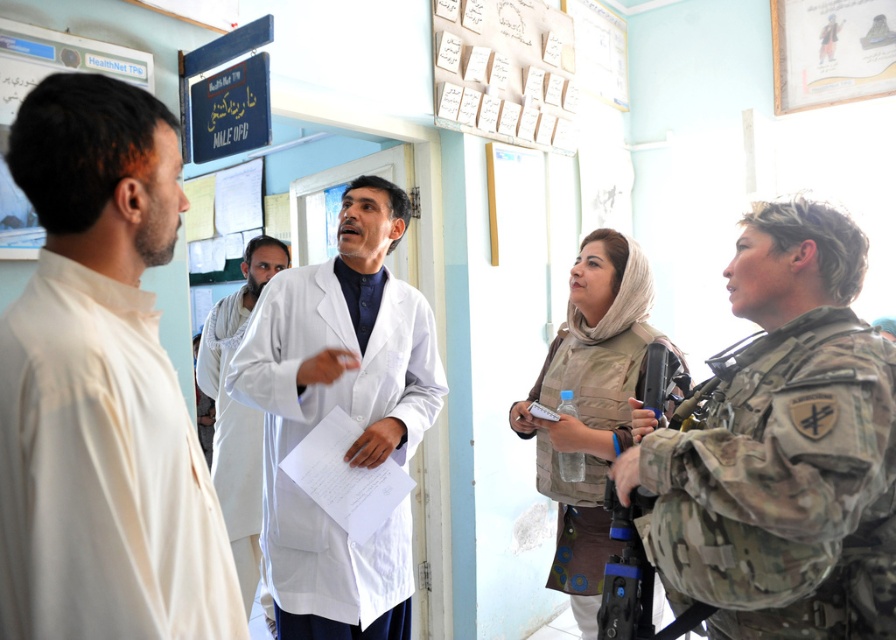
Question: Is white lab coat at left bigger than white lab coat at center?

Choices:
 (A) no
 (B) yes

Answer: (A)

Question: Is camouflage fabric uniform at right bigger than white lab coat at center?

Choices:
 (A) yes
 (B) no

Answer: (B)

Question: Does camouflage fabric uniform at right have a smaller size compared to camouflage vest at center?

Choices:
 (A) no
 (B) yes

Answer: (B)

Question: Which point is closer to the camera taking this photo?

Choices:
 (A) (256, 481)
 (B) (762, 380)
 (C) (74, 384)

Answer: (C)

Question: Which point is closer to the camera?

Choices:
 (A) (134, 634)
 (B) (382, 416)

Answer: (A)

Question: Among these points, which one is farthest from the camera?

Choices:
 (A) (629, 252)
 (B) (240, 339)
 (C) (266, 428)
 (D) (95, 177)

Answer: (B)